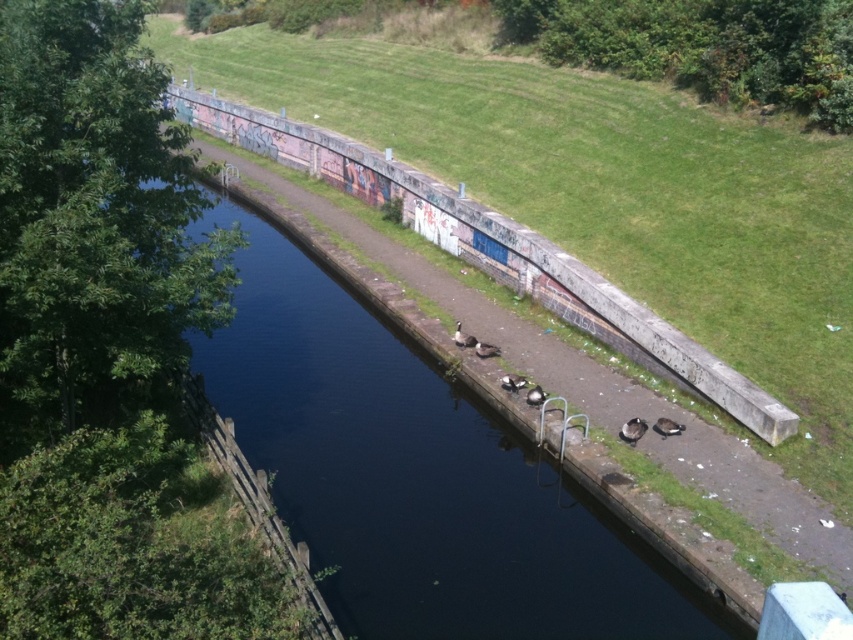
Question: Which point is closer to the camera?

Choices:
 (A) brown feathered duck at center
 (B) green grass at upper center
 (C) brown fuzzy duck at lower right

Answer: (C)

Question: Is dark concrete river at center thinner than brown fuzzy duck at center?

Choices:
 (A) no
 (B) yes

Answer: (A)

Question: Observing the image, what is the correct spatial positioning of brown fuzzy duck at center in reference to dark brown feathers at center?

Choices:
 (A) below
 (B) above

Answer: (B)

Question: Which is nearer to the green grass at upper center?

Choices:
 (A) dark concrete river at center
 (B) brown fuzzy duck at lower right
 (C) brown matte duck at center

Answer: (A)

Question: Which object is farther from the camera taking this photo?

Choices:
 (A) brown fuzzy duck at center
 (B) green grass at upper center
 (C) brown feathered duck at center
 (D) brown matte duck at center

Answer: (B)

Question: Observing the image, what is the correct spatial positioning of brown fuzzy duck at lower center in reference to brown fuzzy duck at center?

Choices:
 (A) below
 (B) above

Answer: (A)